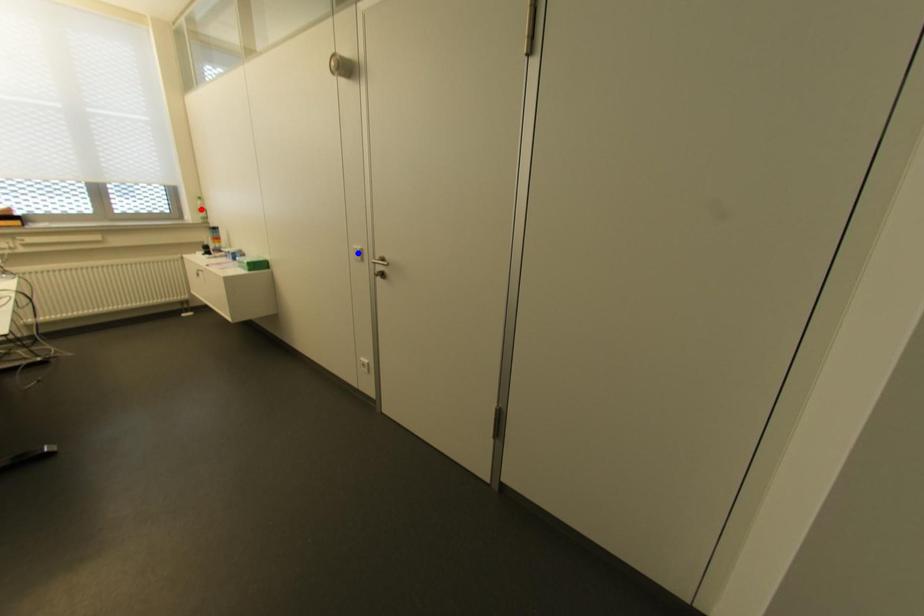
Question: Which of the two points in the image is closer to the camera?

Choices:
 (A) Blue point is closer.
 (B) Red point is closer.

Answer: (A)